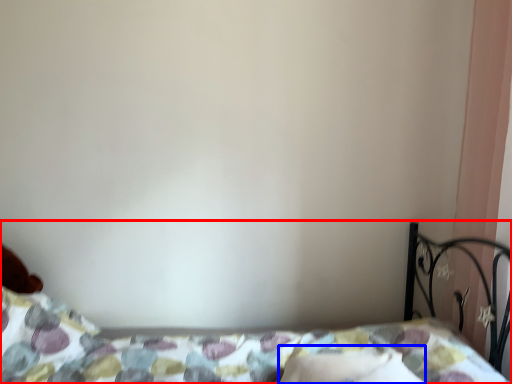
Question: Among these objects, which one is farthest to the camera, bed (highlighted by a red box) or pillow (highlighted by a blue box)?

Choices:
 (A) bed
 (B) pillow

Answer: (B)